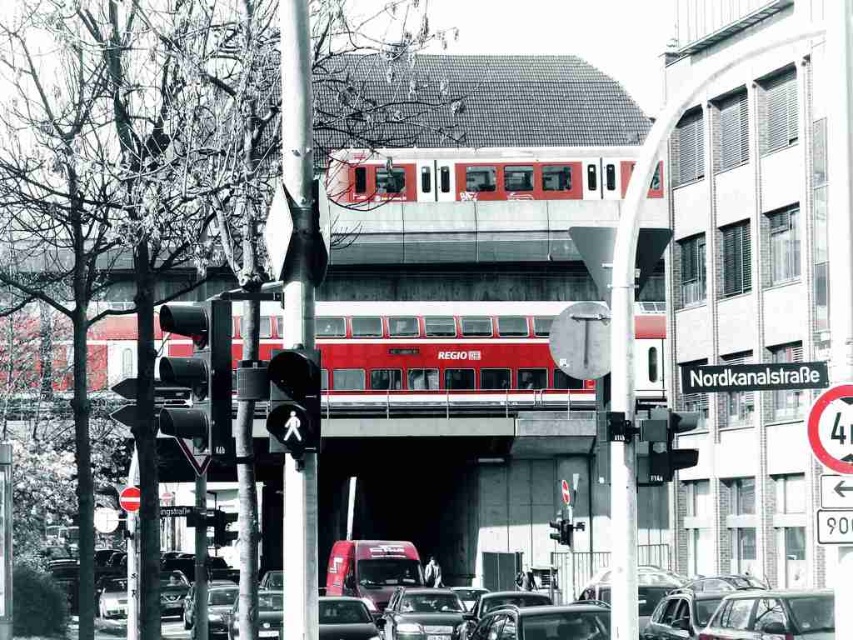
Question: Which of the following is the farthest from the observer?

Choices:
 (A) metallic red van at center
 (B) black matte traffic light at center
 (C) black glass pedestrian signal at center

Answer: (A)

Question: Does metallic pole at center have a larger size compared to shiny silver sedan at center?

Choices:
 (A) no
 (B) yes

Answer: (B)

Question: Observing the image, what is the correct spatial positioning of metallic silver car at center in reference to shiny silver sedan at center?

Choices:
 (A) below
 (B) above

Answer: (B)

Question: Which point is closer to the camera?

Choices:
 (A) (398, 611)
 (B) (331, 168)
 (C) (172, 356)

Answer: (A)

Question: Does matte black traffic light at left have a greater width compared to black plastic street sign at upper center?

Choices:
 (A) no
 (B) yes

Answer: (A)

Question: Which of the following is the farthest from the observer?

Choices:
 (A) matte red train at center
 (B) matte black traffic light at left
 (C) black glass pedestrian signal at center

Answer: (A)